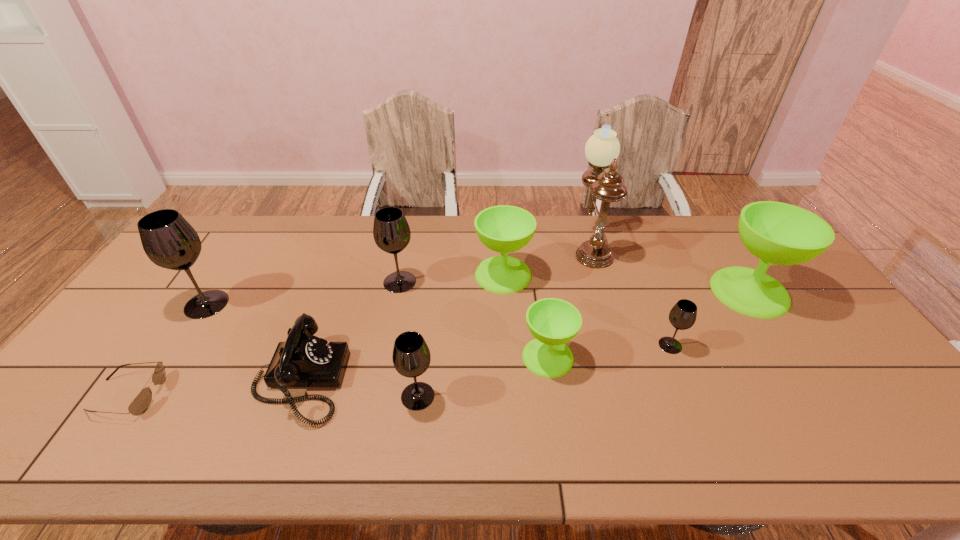
Locate an element on the screen. sunglasses located at the left edge is located at coordinates (140, 404).

Find the location of a particular element. The width and height of the screenshot is (960, 540). object situated at the right edge is located at coordinates tap(778, 233).

Image resolution: width=960 pixels, height=540 pixels. In the image, there is a desktop. Identify the location of free space at the far edge. coord(360,246).

At what (x,y) coordinates should I click in order to perform the action: click on free space at the near edge of the desktop. Please return your answer as a coordinate pair (x, y). This screenshot has height=540, width=960. Looking at the image, I should click on (657, 457).

Identify the location of vacant position at the right edge of the desktop. This screenshot has width=960, height=540. (745, 264).

I want to click on vacant space at the near right corner of the desktop, so click(901, 440).

This screenshot has width=960, height=540. What are the coordinates of `free spot between the second smallest green wineglass and the smallest green wineglass` in the screenshot? It's located at point(525,316).

Locate an element on the screen. The width and height of the screenshot is (960, 540). vacant space that's between the eighth object from left to right and the rightmost gray wineglass is located at coordinates (631, 295).

I want to click on unoccupied position between the second wineglass from left to right and the biggest green wineglass, so click(x=574, y=287).

Where is `free space between the oil lamp and the sixth wineglass from left to right`? free space between the oil lamp and the sixth wineglass from left to right is located at coordinates (631, 295).